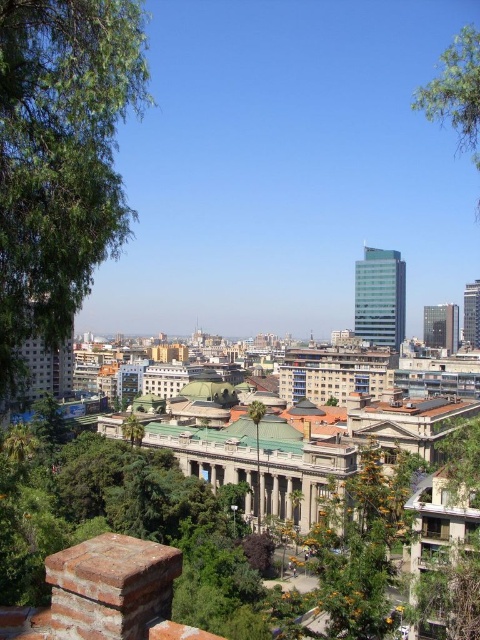
Is green leafy tree at left below green leafy tree at upper right?

Correct, green leafy tree at left is located below green leafy tree at upper right.

Who is positioned more to the right, green leafy tree at left or green leafy tree at upper right?

green leafy tree at upper right

Measure the distance between point (64,180) and camera.

A distance of 50.98 meters exists between point (64,180) and camera.

You are a GUI agent. You are given a task and a screenshot of the screen. Output one action in this format:
    pyautogui.click(x=<x>, y=<y>)
    Task: Click on the green leafy tree at left
    The image size is (480, 640).
    Given the screenshot: What is the action you would take?
    pyautogui.click(x=60, y=157)

Is green leafy tree at upper right to the right of green leafy tree at center from the viewer's perspective?

Indeed, green leafy tree at upper right is positioned on the right side of green leafy tree at center.

Is point (470, 104) less distant than point (259, 467)?

Yes, it is in front of point (259, 467).

The width and height of the screenshot is (480, 640). In order to click on green leafy tree at upper right in this screenshot , I will do `click(456, 90)`.

Identify the location of green leafy tree at upper right. The width and height of the screenshot is (480, 640). (456, 90).

Between point (12, 326) and point (259, 500), which one is positioned behind?

Positioned behind is point (259, 500).

Who is taller, green leafy tree at left or green leafy tree at center?

green leafy tree at left is taller.

Which is behind, point (22, 177) or point (254, 429)?

The point (254, 429) is more distant.

Find the location of a particular element. Image resolution: width=480 pixels, height=640 pixels. green leafy tree at left is located at coordinates (60, 157).